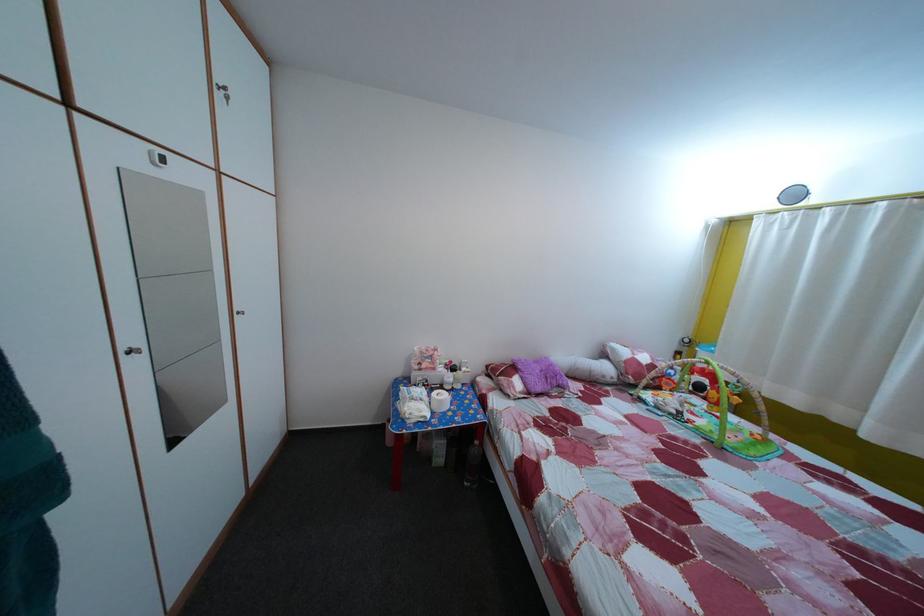
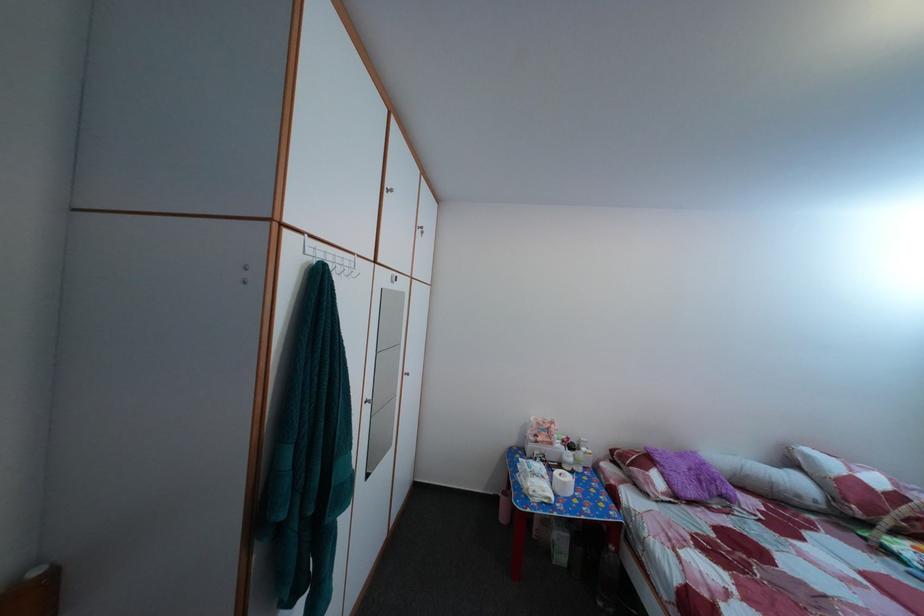
Find the pixel in the second image that matches (623,357) in the first image.

(817, 464)